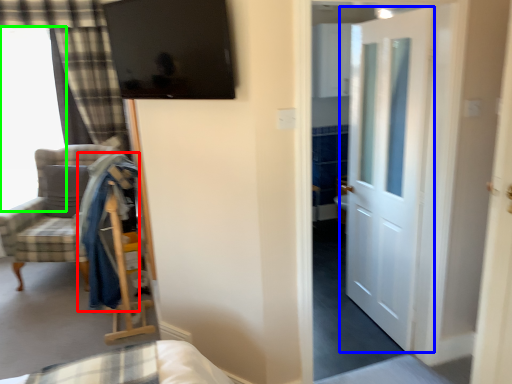
Question: Which is nearer to the robe (highlighted by a red box)? door (highlighted by a blue box) or window (highlighted by a green box).

Choices:
 (A) door
 (B) window

Answer: (A)